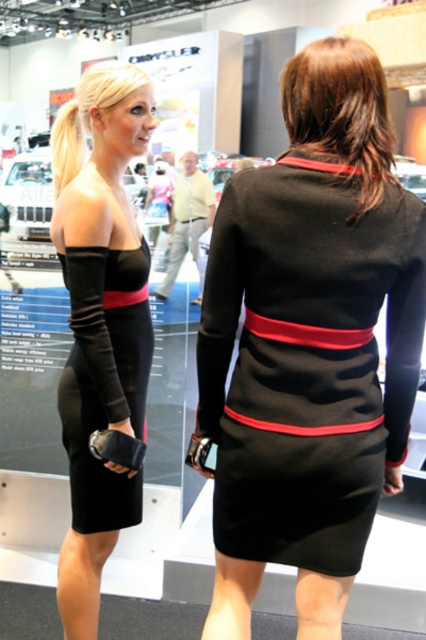
Question: Considering the real-world distances, which object is farthest from the yellow cotton shirt at center?

Choices:
 (A) black matte dress at center
 (B) matte black dress at left

Answer: (B)

Question: Which object is positioned farthest from the black matte dress at center?

Choices:
 (A) black satin dress at center
 (B) matte black dress at left

Answer: (B)

Question: Considering the relative positions of matte black dress at left and black satin dress at center in the image provided, where is matte black dress at left located with respect to black satin dress at center?

Choices:
 (A) below
 (B) above

Answer: (A)

Question: Is black matte dress at center positioned before matte black dress at left?

Choices:
 (A) yes
 (B) no

Answer: (A)

Question: Estimate the real-world distances between objects in this image. Which object is closer to the matte black dress at left?

Choices:
 (A) black matte dress at center
 (B) black satin dress at center
 (C) yellow cotton shirt at center

Answer: (B)

Question: Does matte black dress at left lie in front of black satin dress at center?

Choices:
 (A) yes
 (B) no

Answer: (B)